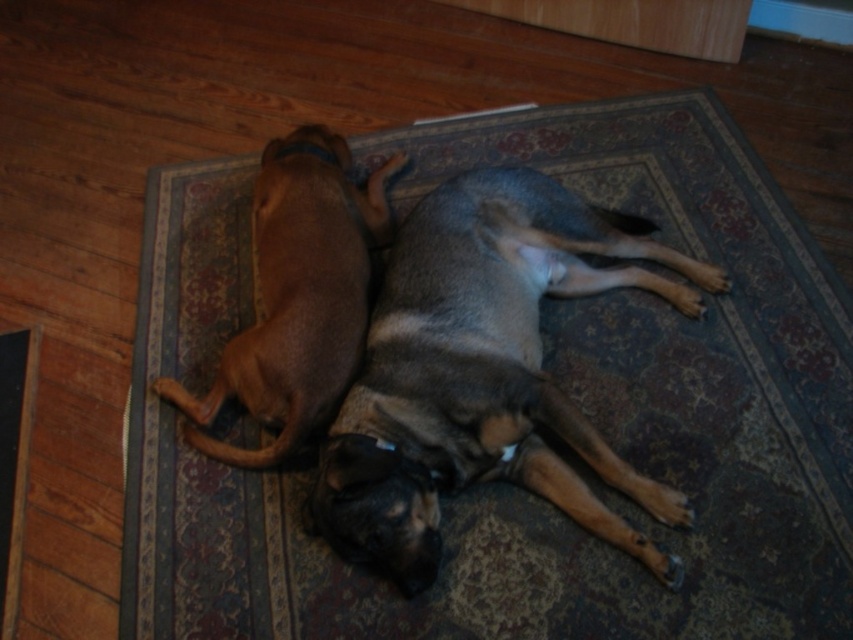
You are trying to place a new toy for the brown matte dog at upper left. Based on the scene, where should you place the toy so it is closest to the dog but not on the carpeted rug at center?

The carpeted rug at center is positioned on the right side of brown matte dog at upper left. Therefore, placing the toy to the left of the brown matte dog at upper left would keep it closest to the dog while avoiding the carpeted rug at center.